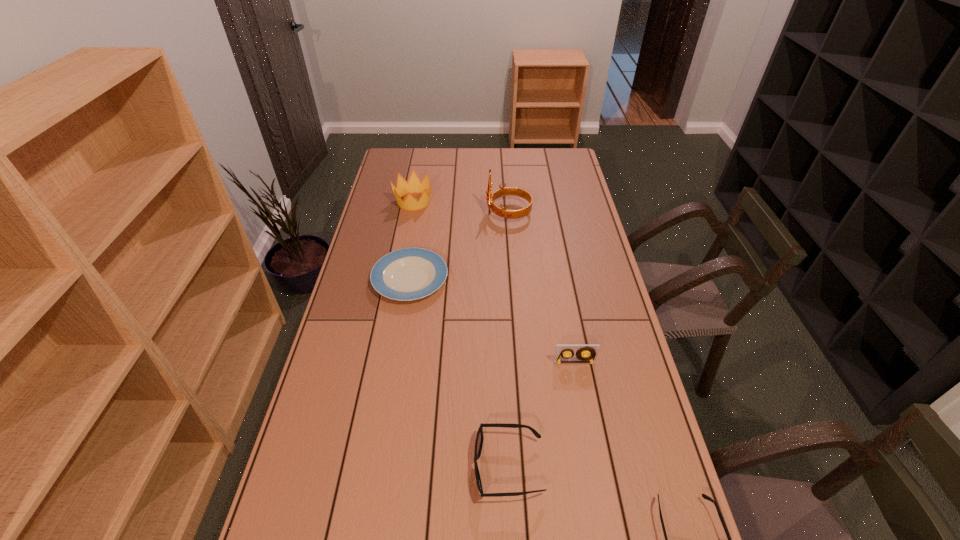
I want to click on free point that keeps the sunglassess evenly spaced on the left, so click(x=360, y=415).